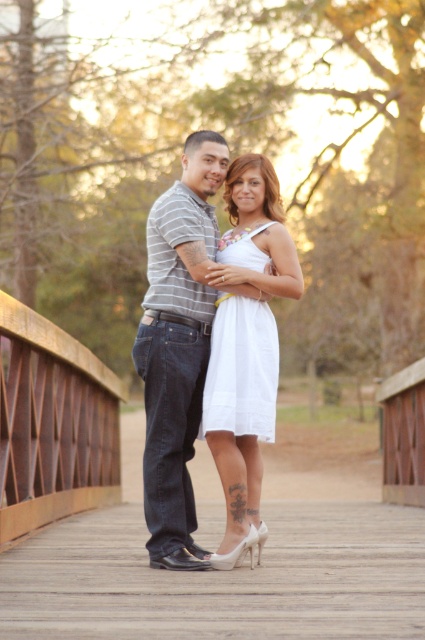
You are a photographer positioned at the bridge and want to take a photo of the couple. Since the brown wooden bridge at lower left and the white sheer dress at center are in your view, which object is closer to you?

The brown wooden bridge at lower left is closer to you because it is further to the viewer than the white sheer dress at center.

You are a photographer positioned at the brown wooden bridge at lower left, aiming to capture a portrait of the white sheer dress at center. Given that your camera has a maximum focus range of 10 feet, will you be able to clearly photograph the dress?

The distance between the brown wooden bridge at lower left and the white sheer dress at center is 9.22 feet, which is within the camera maximum focus range of 10 feet. Therefore, you can clearly photograph the dress.